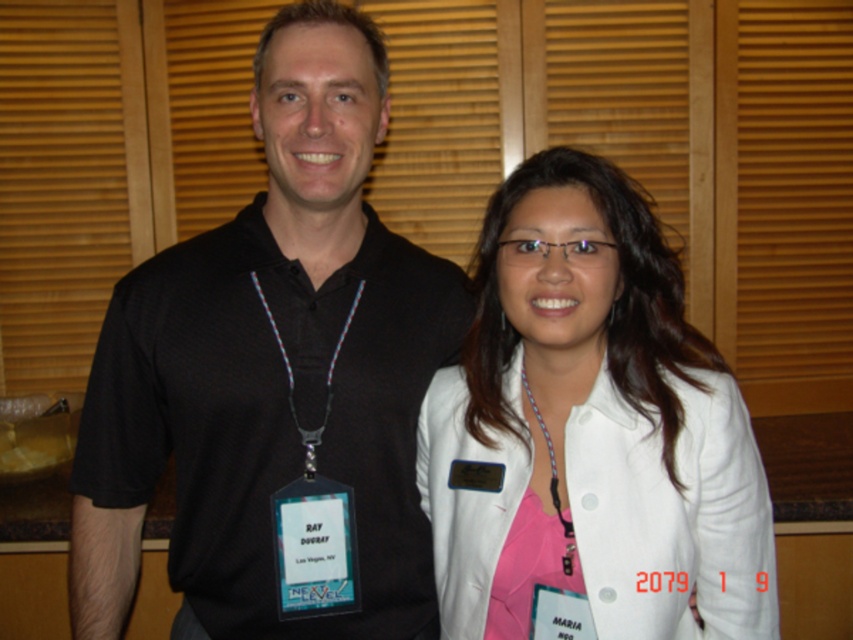
Is black mesh shirt at center thinner than white matte jacket at center?

Incorrect, black mesh shirt at center's width is not less than white matte jacket at center's.

Does black mesh shirt at center have a larger size compared to white matte jacket at center?

Yes, black mesh shirt at center is bigger than white matte jacket at center.

Is point (410, 380) positioned behind point (630, 499)?

That is True.

What are the coordinates of `black mesh shirt at center` in the screenshot? It's located at (271, 369).

Is white matte jacket at center above purple beaded necklace at center?

Yes, white matte jacket at center is above purple beaded necklace at center.

Describe the element at coordinates (590, 433) in the screenshot. I see `white matte jacket at center` at that location.

Between point (519, 413) and point (521, 372), which one is positioned behind?

The point (521, 372) is more distant.

At what (x,y) coordinates should I click in order to perform the action: click on white matte jacket at center. Please return your answer as a coordinate pair (x, y). The height and width of the screenshot is (640, 853). Looking at the image, I should click on (590, 433).

Does point (194, 275) come closer to viewer compared to point (558, 515)?

No, (194, 275) is behind (558, 515).

Which of these two, black mesh shirt at center or purple beaded necklace at center, stands taller?

Standing taller between the two is black mesh shirt at center.

At what (x,y) coordinates should I click in order to perform the action: click on black mesh shirt at center. Please return your answer as a coordinate pair (x, y). The width and height of the screenshot is (853, 640). Looking at the image, I should click on (271, 369).

You are a GUI agent. You are given a task and a screenshot of the screen. Output one action in this format:
    pyautogui.click(x=<x>, y=<y>)
    Task: Click on the black mesh shirt at center
    
    Given the screenshot: What is the action you would take?
    pyautogui.click(x=271, y=369)